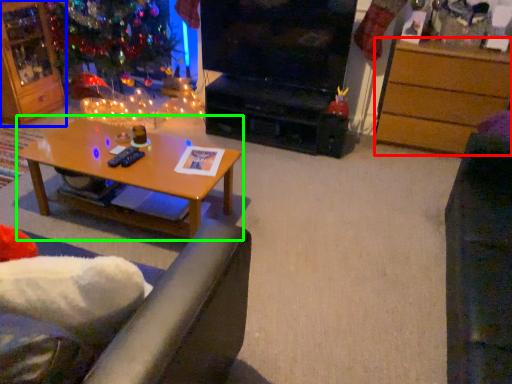
Question: Which object is the closest to the desk (highlighted by a red box)? Choose among these: cabinetry (highlighted by a blue box) or coffee table (highlighted by a green box).

Choices:
 (A) cabinetry
 (B) coffee table

Answer: (B)